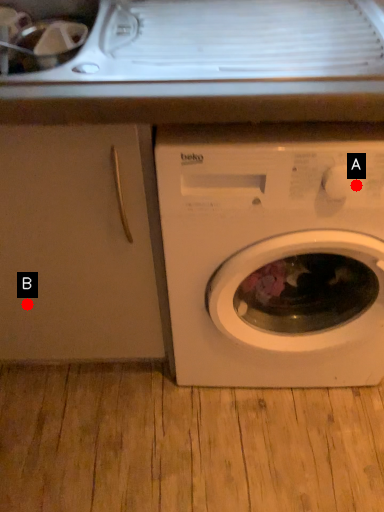
Question: Two points are circled on the image, labeled by A and B beside each circle. Among these points, which one is nearest to the camera?

Choices:
 (A) A is closer
 (B) B is closer

Answer: (A)